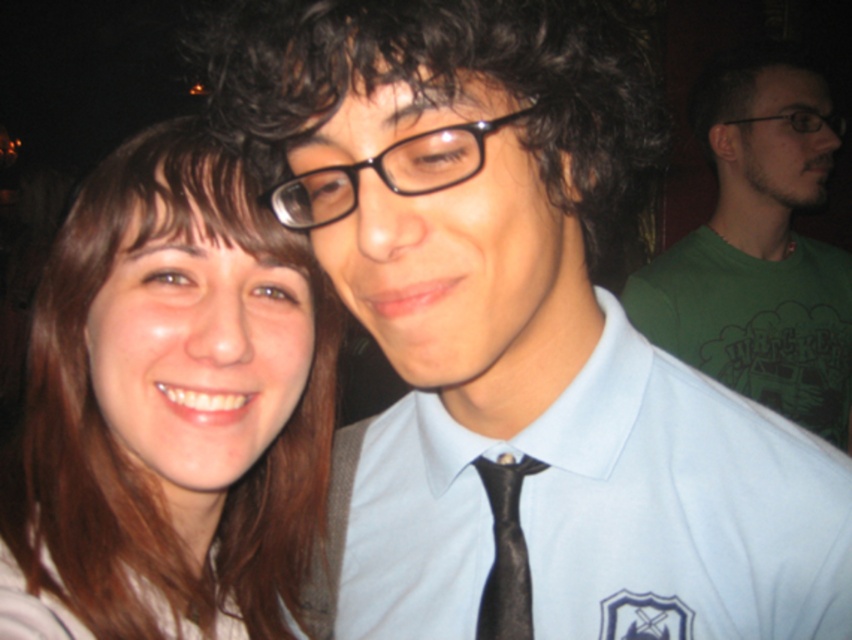
You are a photographer adjusting the lighting for a portrait. You notice the light blue smooth dress shirt at center and the dark curly hair at center in the frame. Which object should you adjust the lighting to highlight first if you want to ensure both are visible? Explain your reasoning.

The light blue smooth dress shirt at center is positioned under dark curly hair at center. To ensure both are visible, you should first adjust the lighting to highlight the dark curly hair at center since it is above the shirt and might cast shadows affecting the lower area.